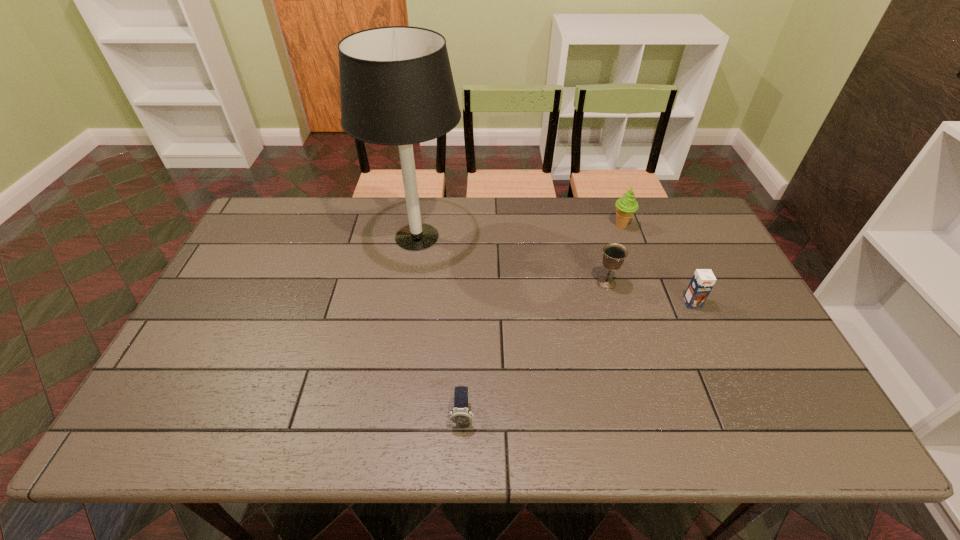
Locate an element on the screen. Image resolution: width=960 pixels, height=540 pixels. vacant area that lies between the fourth shortest object and the nearest object is located at coordinates (541, 320).

The width and height of the screenshot is (960, 540). I want to click on free space between the tallest object and the rightmost object, so (x=555, y=270).

Locate an element on the screen. object identified as the third closest to the rightmost object is located at coordinates (396, 85).

Point out which object is positioned as the fourth nearest to the watch. Please provide its 2D coordinates. Your answer should be formatted as a tuple, i.e. [(x, y)], where the tuple contains the x and y coordinates of a point satisfying the conditions above.

[(625, 206)]